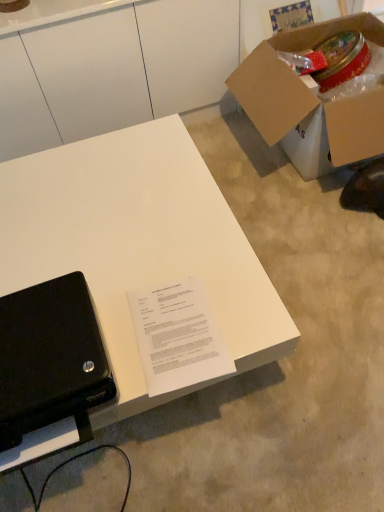
What do you see at coordinates (138, 245) in the screenshot? I see `white matte desk at lower left` at bounding box center [138, 245].

What do you see at coordinates (310, 102) in the screenshot? I see `cardboard box at upper right` at bounding box center [310, 102].

Find the location of a particular element. This screenshot has width=384, height=512. black matte laptop at lower left is located at coordinates (50, 359).

Considering the positions of points (146, 406) and (70, 357), is point (146, 406) farther from camera compared to point (70, 357)?

Yes, it is.

From the image's perspective, is white matte desk at lower left positioned above or below black matte laptop at lower left?

white matte desk at lower left is above black matte laptop at lower left.

Do you think white matte desk at lower left is within black matte laptop at lower left, or outside of it?

white matte desk at lower left is not inside black matte laptop at lower left, it's outside.

Is white matte desk at lower left oriented towards black matte laptop at lower left?

No, white matte desk at lower left is not turned towards black matte laptop at lower left.

From the image's perspective, is cardboard box at upper right on top of white matte desk at lower left?

Yes, from the image's perspective, cardboard box at upper right is above white matte desk at lower left.

Which of these two, cardboard box at upper right or white matte desk at lower left, stands taller?

cardboard box at upper right is taller.

Is cardboard box at upper right far away from white matte desk at lower left?

That's not correct — cardboard box at upper right is a little close to white matte desk at lower left.

How far apart are white paper at center and cardboard box at upper right?

They are 34.63 inches apart.

Between white paper at center and cardboard box at upper right, which one has more height?

cardboard box at upper right.

Which of these two, white paper at center or cardboard box at upper right, is wider?

cardboard box at upper right is wider.

Between white paper at center and cardboard box at upper right, which one appears on the left side from the viewer's perspective?

Positioned to the left is white paper at center.

What's the angular difference between cardboard box at upper right and black matte laptop at lower left's facing directions?

There is a 2.88-degree angle between the facing directions of cardboard box at upper right and black matte laptop at lower left.

Is cardboard box at upper right facing away from black matte laptop at lower left?

cardboard box at upper right is not turned away from black matte laptop at lower left.

Are cardboard box at upper right and black matte laptop at lower left far apart?

Yes.

Is cardboard box at upper right inside the boundaries of white paper at center, or outside?

cardboard box at upper right cannot be found inside white paper at center.

This screenshot has height=512, width=384. Identify the location of writing located below the cardboard box at upper right (from the image's perspective). (176, 330).

Considering the sizes of objects cardboard box at upper right and white paper at center in the image provided, who is shorter, cardboard box at upper right or white paper at center?

With less height is white paper at center.

From the picture: From the image's perspective, is cardboard box at upper right located above or below white paper at center?

From the image's perspective, cardboard box at upper right appears above white paper at center.

Which object is closer to the camera, black matte laptop at lower left or cardboard box at upper right?

Positioned in front is black matte laptop at lower left.

In the scene shown: Is black matte laptop at lower left bigger than cardboard box at upper right?

Incorrect, black matte laptop at lower left is not larger than cardboard box at upper right.

At what (x,y) coordinates should I click in order to perform the action: click on box directly beneath the black matte laptop at lower left (from a real-world perspective). Please return your answer as a coordinate pair (x, y). Looking at the image, I should click on click(x=310, y=102).

Can you confirm if black matte laptop at lower left is positioned to the left of white matte desk at lower left?

Correct, you'll find black matte laptop at lower left to the left of white matte desk at lower left.

Considering the relative sizes of black matte laptop at lower left and white matte desk at lower left in the image provided, is black matte laptop at lower left shorter than white matte desk at lower left?

Yes.

Where is `desk that appears below the black matte laptop at lower left (from a real-world perspective)`? The width and height of the screenshot is (384, 512). desk that appears below the black matte laptop at lower left (from a real-world perspective) is located at coordinates (138, 245).

Is black matte laptop at lower left in front of white matte desk at lower left?

Yes.

You are a GUI agent. You are given a task and a screenshot of the screen. Output one action in this format:
    pyautogui.click(x=<x>, y=<y>)
    Task: Click on the laptop lying on the left of white matte desk at lower left
    The width and height of the screenshot is (384, 512).
    Given the screenshot: What is the action you would take?
    pyautogui.click(x=50, y=359)

This screenshot has width=384, height=512. Find the location of `desk in front of the cardboard box at upper right`. desk in front of the cardboard box at upper right is located at coordinates tap(138, 245).

When comparing their distances from cardboard box at upper right, does black matte laptop at lower left or white paper at center seem closer?

white paper at center lies closer to cardboard box at upper right than the other object.

When comparing their distances from cardboard box at upper right, does white paper at center or white matte desk at lower left seem further?

white paper at center is further to cardboard box at upper right.

Based on their spatial positions, is white paper at center or black matte laptop at lower left further from cardboard box at upper right?

black matte laptop at lower left lies further to cardboard box at upper right than the other object.

Looking at the image, which one is located closer to white paper at center, cardboard box at upper right or black matte laptop at lower left?

black matte laptop at lower left lies closer to white paper at center than the other object.

Based on their spatial positions, is white matte desk at lower left or black matte laptop at lower left further from white paper at center?

The object further to white paper at center is white matte desk at lower left.

Estimate the real-world distances between objects in this image. Which object is further from cardboard box at upper right, white matte desk at lower left or black matte laptop at lower left?

black matte laptop at lower left lies further to cardboard box at upper right than the other object.

Which object lies further to the anchor point black matte laptop at lower left, white matte desk at lower left or cardboard box at upper right?

Answer: cardboard box at upper right is further to black matte laptop at lower left.

When comparing their distances from black matte laptop at lower left, does white matte desk at lower left or white paper at center seem further?

Based on the image, white matte desk at lower left appears to be further to black matte laptop at lower left.

Locate an element on the screen. Image resolution: width=384 pixels, height=512 pixels. writing between white matte desk at lower left and cardboard box at upper right in the horizontal direction is located at coordinates (176, 330).

Image resolution: width=384 pixels, height=512 pixels. I want to click on desk between black matte laptop at lower left and white paper at center, so click(x=138, y=245).

Where is `writing that lies between cardboard box at upper right and black matte laptop at lower left from top to bottom`? writing that lies between cardboard box at upper right and black matte laptop at lower left from top to bottom is located at coordinates (176, 330).

This screenshot has height=512, width=384. What are the coordinates of `desk between black matte laptop at lower left and cardboard box at upper right` in the screenshot? It's located at (138, 245).